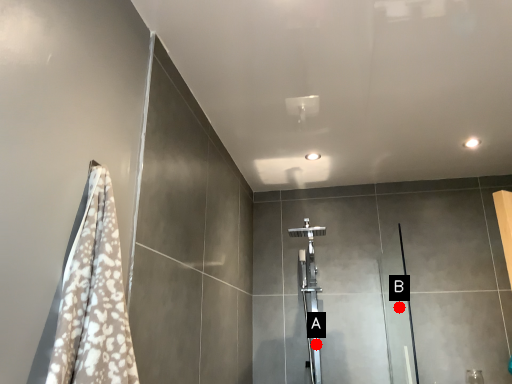
Question: Two points are circled on the image, labeled by A and B beside each circle. Which of the following is the closest to the observer?

Choices:
 (A) A is closer
 (B) B is closer

Answer: (B)